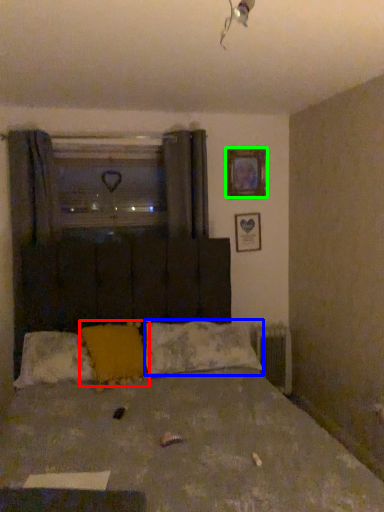
Question: Based on their relative distances, which object is nearer to pillow (highlighted by a red box)? Choose from pillow (highlighted by a blue box) and picture frame (highlighted by a green box).

Choices:
 (A) pillow
 (B) picture frame

Answer: (A)